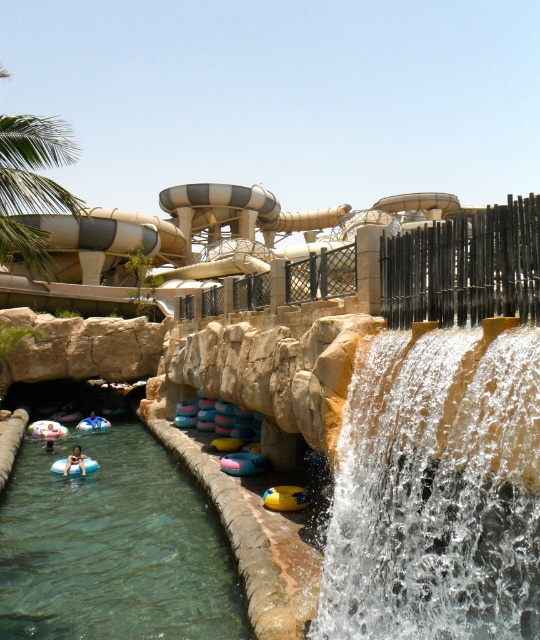
This screenshot has height=640, width=540. In order to click on translucent blue rubber ring at lower left in this screenshot , I will do `click(112, 547)`.

Which is above, translucent blue rubber ring at lower left or light blue rubber ring at lower left?

light blue rubber ring at lower left is higher up.

The width and height of the screenshot is (540, 640). Describe the element at coordinates (112, 547) in the screenshot. I see `translucent blue rubber ring at lower left` at that location.

Where is `translucent blue rubber ring at lower left`? This screenshot has width=540, height=640. translucent blue rubber ring at lower left is located at coordinates (112, 547).

From the picture: Between translucent blue rubber ring at lower left and green leafy palm tree at upper left, which one is positioned lower?

Positioned lower is translucent blue rubber ring at lower left.

Based on the photo, is translucent blue rubber ring at lower left smaller than green leafy palm tree at upper left?

Yes, translucent blue rubber ring at lower left is smaller than green leafy palm tree at upper left.

What do you see at coordinates (112, 547) in the screenshot? This screenshot has width=540, height=640. I see `translucent blue rubber ring at lower left` at bounding box center [112, 547].

The image size is (540, 640). I want to click on translucent blue rubber ring at lower left, so (x=112, y=547).

Does clear water cascade at center come in front of green leafy palm tree at upper left?

That is True.

Can you confirm if clear water cascade at center is shorter than green leafy palm tree at upper left?

Yes.

Between point (501, 528) and point (6, 220), which one is positioned in front?

Point (501, 528) is more forward.

You are a GUI agent. You are given a task and a screenshot of the screen. Output one action in this format:
    pyautogui.click(x=<x>, y=<y>)
    Task: Click on the clear water cascade at center
    
    Given the screenshot: What is the action you would take?
    pyautogui.click(x=435, y=492)